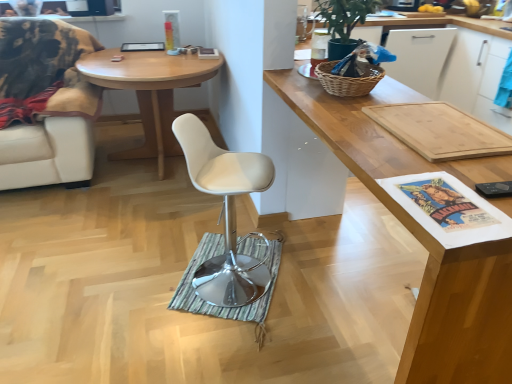
Identify the location of free space that is to the left of green striped mat at center. (137, 288).